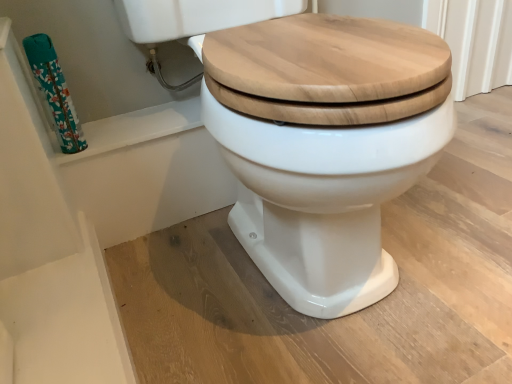
Question: Based on their positions, is teal floral-patterned toilet paper at left located to the left or right of white glossy toilet at center?

Choices:
 (A) right
 (B) left

Answer: (B)

Question: From a real-world perspective, is teal floral-patterned toilet paper at left above or below white glossy toilet at center?

Choices:
 (A) below
 (B) above

Answer: (B)

Question: Considering the positions of teal floral-patterned toilet paper at left and white glossy toilet at center in the image, is teal floral-patterned toilet paper at left wider or thinner than white glossy toilet at center?

Choices:
 (A) wide
 (B) thin

Answer: (B)

Question: In terms of height, does white glossy toilet at center look taller or shorter compared to teal floral-patterned toilet paper at left?

Choices:
 (A) short
 (B) tall

Answer: (B)

Question: Is white glossy toilet at center wider or thinner than teal floral-patterned toilet paper at left?

Choices:
 (A) thin
 (B) wide

Answer: (B)

Question: Do you think white glossy toilet at center is within teal floral-patterned toilet paper at left, or outside of it?

Choices:
 (A) inside
 (B) outside

Answer: (B)

Question: In the image, is white glossy toilet at center positioned in front of or behind teal floral-patterned toilet paper at left?

Choices:
 (A) behind
 (B) front

Answer: (B)